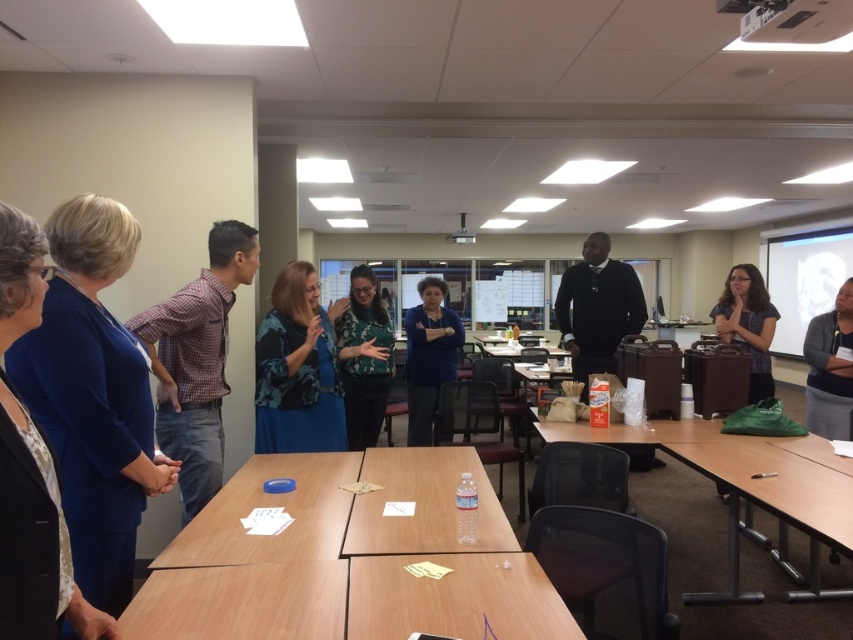
Question: Does wooden table at center have a greater width compared to green fabric bag at lower right?

Choices:
 (A) yes
 (B) no

Answer: (B)

Question: Does wooden table at center have a smaller size compared to green fabric bag at lower right?

Choices:
 (A) no
 (B) yes

Answer: (B)

Question: Which of the following is the closest to the observer?

Choices:
 (A) blue floral blouse at center
 (B) green fabric bag at lower right

Answer: (B)

Question: Observing the image, what is the correct spatial positioning of wooden table at center in reference to blue fabric jacket at left?

Choices:
 (A) below
 (B) above

Answer: (A)

Question: Estimate the real-world distances between objects in this image. Which object is farther from the blue fabric jacket at left?

Choices:
 (A) blue floral blouse at center
 (B) green fabric bag at lower right
 (C) blue fabric shirt at center

Answer: (C)

Question: Based on their relative distances, which object is nearer to the wooden table at center?

Choices:
 (A) blue fabric shirt at center
 (B) green fabric bag at lower right

Answer: (B)